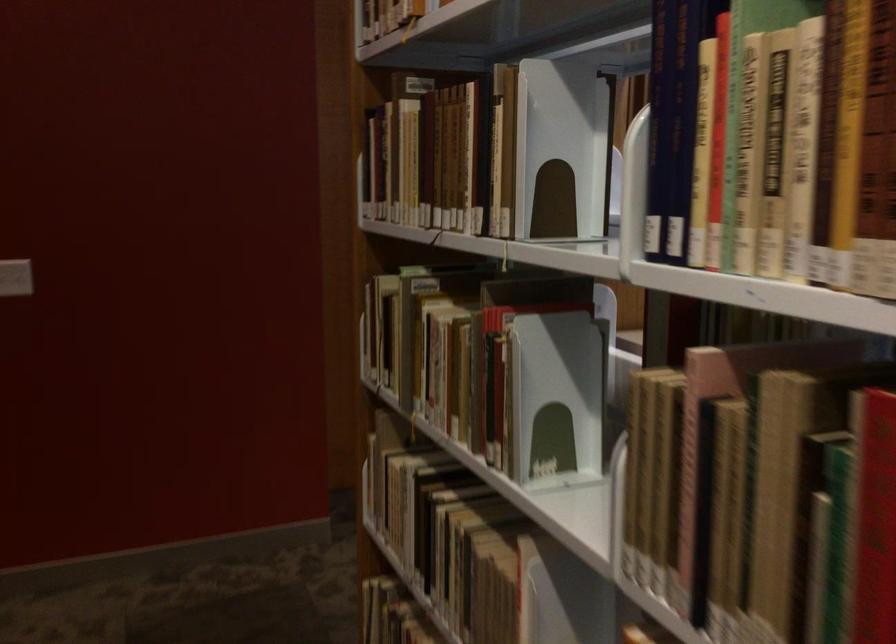
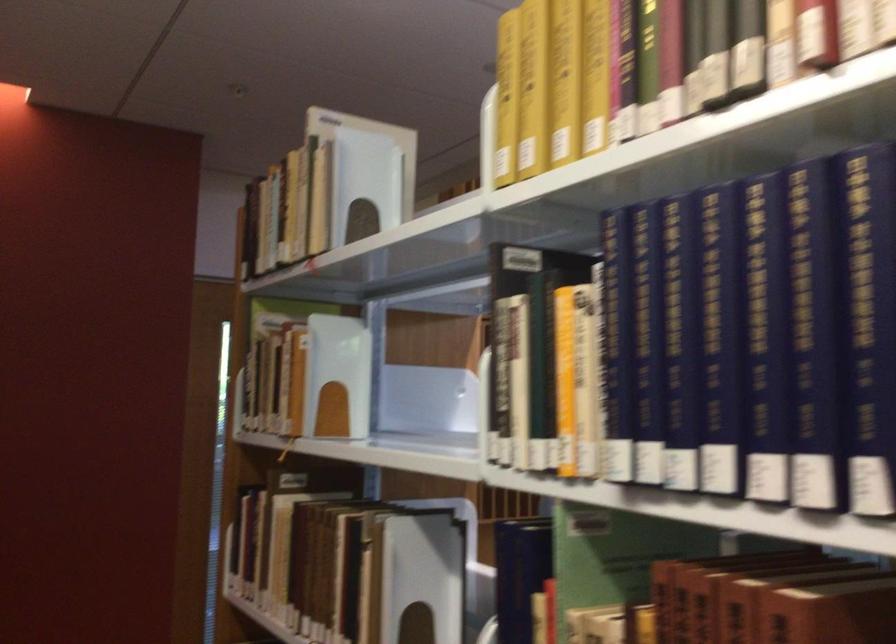
Question: The images are taken continuously from a first-person perspective. In which direction are you moving?

Choices:
 (A) Left
 (B) Right
 (C) Forward
 (D) Backward

Answer: (D)